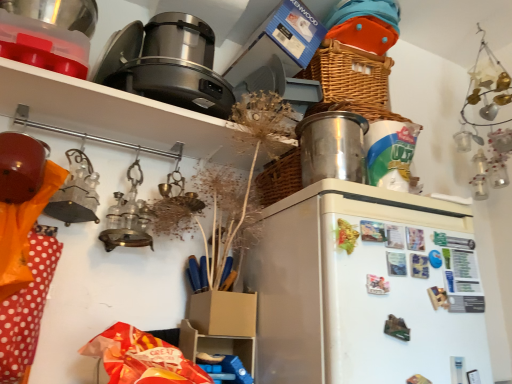
Question: From a real-world perspective, is matte black pot at upper left positioned under white matte refrigerator at center based on gravity?

Choices:
 (A) yes
 (B) no

Answer: (B)

Question: Is matte black pot at upper left facing towards white matte refrigerator at center?

Choices:
 (A) no
 (B) yes

Answer: (A)

Question: From a real-world perspective, does matte black pot at upper left stand above white matte refrigerator at center?

Choices:
 (A) no
 (B) yes

Answer: (B)

Question: Considering the relative sizes of matte black pot at upper left and white matte refrigerator at center in the image provided, is matte black pot at upper left taller than white matte refrigerator at center?

Choices:
 (A) no
 (B) yes

Answer: (A)

Question: Is matte black pot at upper left positioned beyond the bounds of white matte refrigerator at center?

Choices:
 (A) yes
 (B) no

Answer: (A)

Question: From the image's perspective, is matte black pot at upper left located beneath white matte refrigerator at center?

Choices:
 (A) yes
 (B) no

Answer: (B)

Question: Is white matte refrigerator at center not inside satin silver appliance at upper center, positioned as the 2th appliance in bottom-to-top order?

Choices:
 (A) no
 (B) yes

Answer: (B)

Question: From the image's perspective, does white matte refrigerator at center appear lower than satin silver appliance at upper center, which appears as the second appliance when viewed from the right?

Choices:
 (A) yes
 (B) no

Answer: (A)

Question: Does white matte refrigerator at center have a lesser height compared to satin silver appliance at upper center, which ranks as the first appliance in left-to-right order?

Choices:
 (A) no
 (B) yes

Answer: (A)

Question: Could you tell me if white matte refrigerator at center is facing satin silver appliance at upper center, marked as the 1th appliance in a top-to-bottom arrangement?

Choices:
 (A) no
 (B) yes

Answer: (A)

Question: Is the position of white matte refrigerator at center more distant than that of satin silver appliance at upper center, positioned as the 2th appliance in bottom-to-top order?

Choices:
 (A) no
 (B) yes

Answer: (A)

Question: Is white matte refrigerator at center thinner than satin silver appliance at upper center, which ranks as the first appliance in left-to-right order?

Choices:
 (A) yes
 (B) no

Answer: (B)

Question: Is matte black pot at upper left taller than shiny metallic container at upper right, the 1th appliance ordered from the bottom?

Choices:
 (A) yes
 (B) no

Answer: (A)